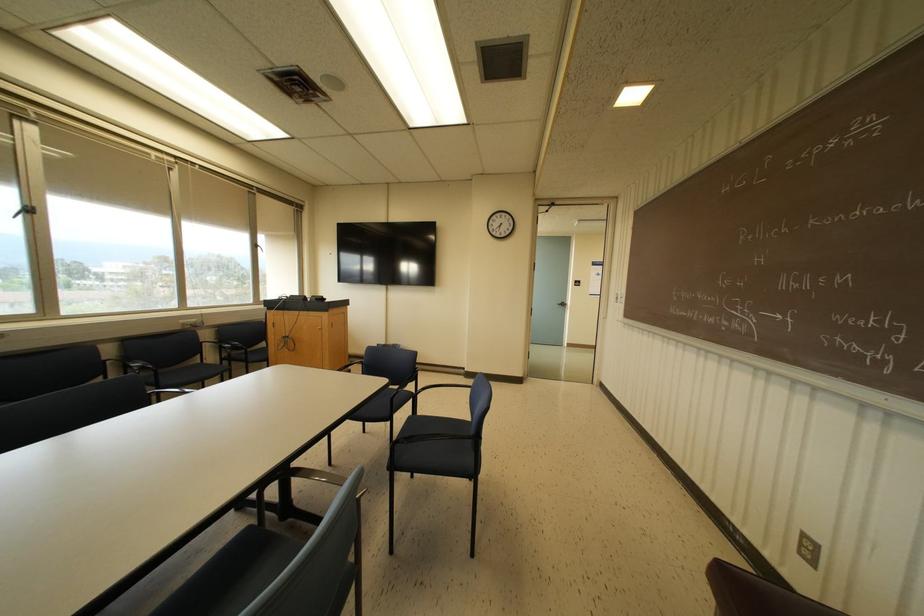
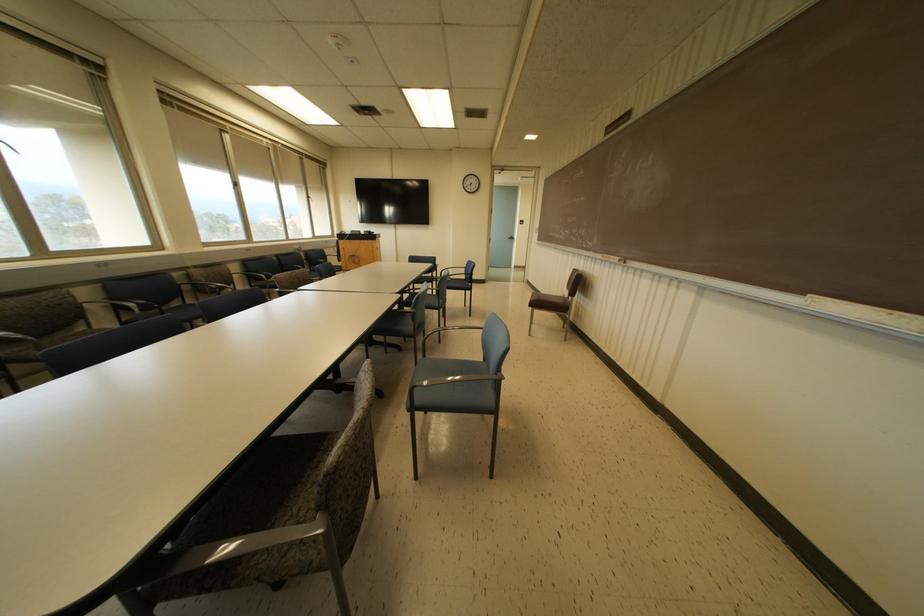
In the second image, find the point that corresponds to point 563,304 in the first image.

(512, 238)